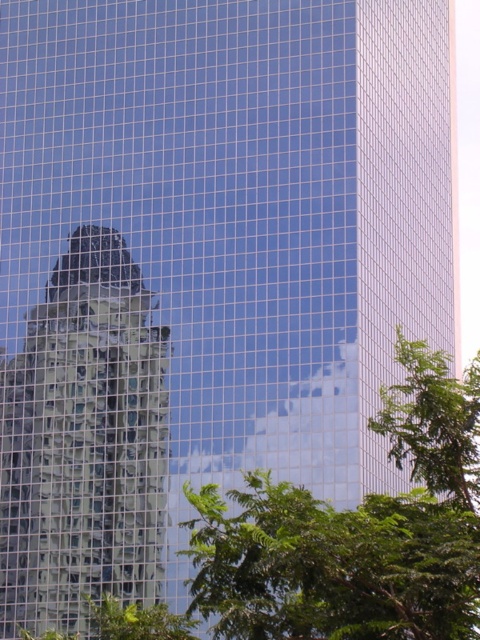
Question: Is reflective glass building at center below green leafy tree at center?

Choices:
 (A) no
 (B) yes

Answer: (A)

Question: Which of the following is the farthest from the observer?

Choices:
 (A) (387, 636)
 (B) (144, 451)

Answer: (B)

Question: Is reflective glass building at center closer to the viewer compared to green leafy tree at center?

Choices:
 (A) yes
 (B) no

Answer: (B)

Question: Which point is farther to the camera?

Choices:
 (A) green leafy tree at center
 (B) reflective glass building at center

Answer: (B)

Question: Is reflective glass building at center above green leafy tree at center?

Choices:
 (A) no
 (B) yes

Answer: (B)

Question: Which object appears farthest from the camera in this image?

Choices:
 (A) green leafy tree at center
 (B) reflective glass building at center

Answer: (B)